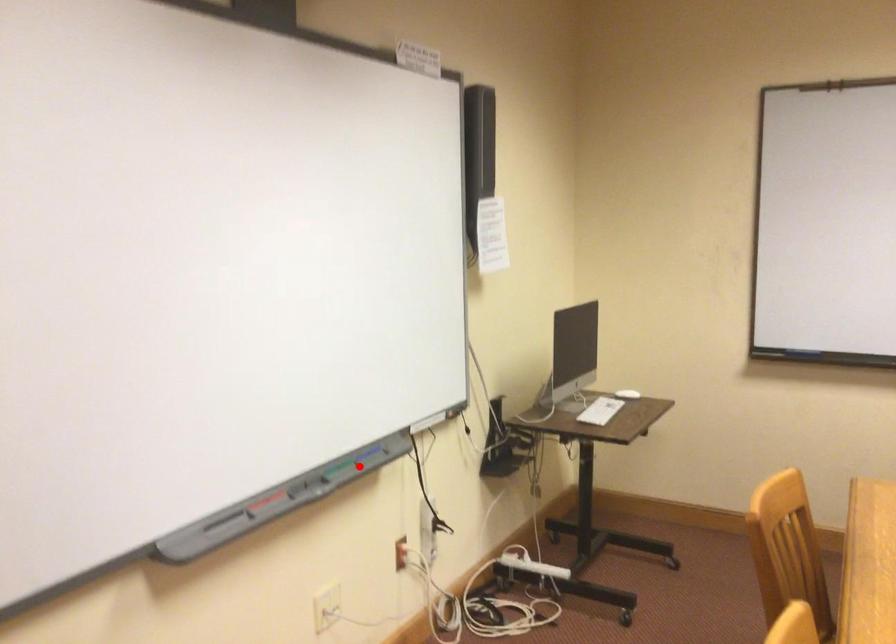
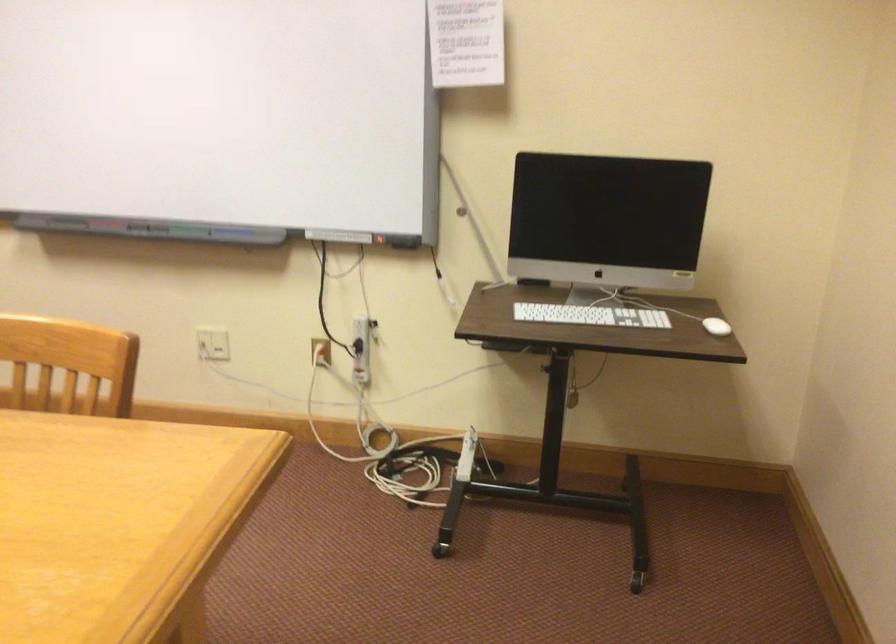
Question: I am providing you with two images of the same scene from different viewpoints. A red point is marked on the first image. Is the red point's position out of view in image 2?

Choices:
 (A) Yes
 (B) No

Answer: (B)